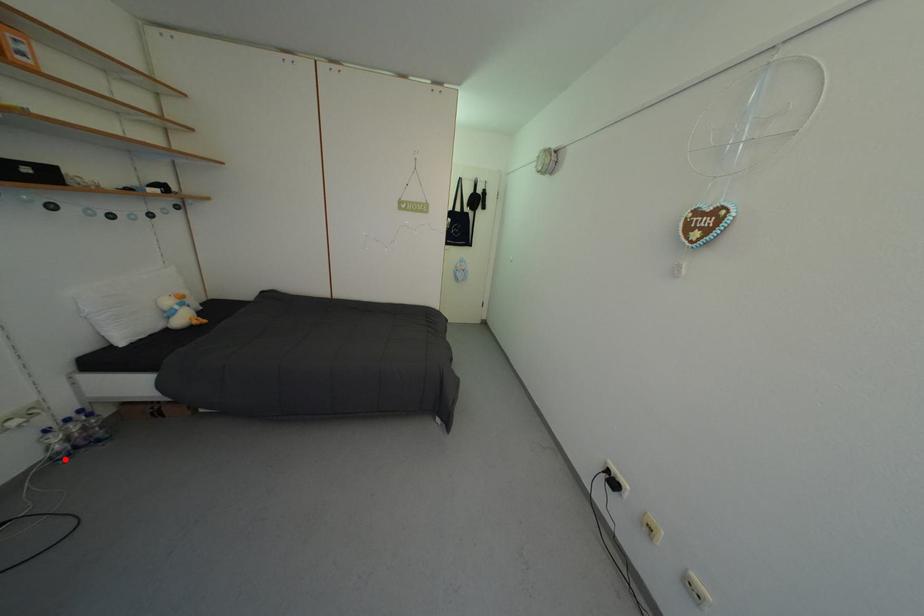
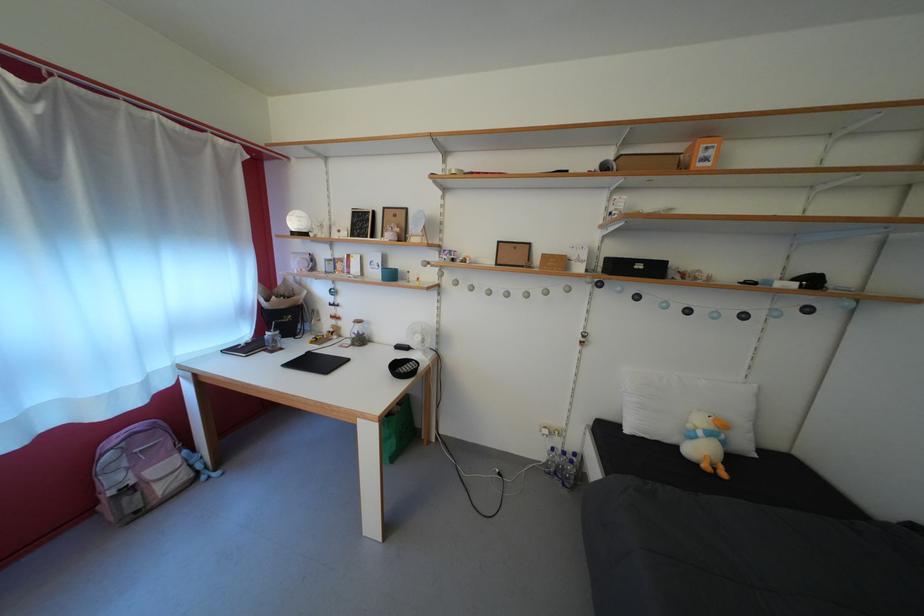
Where in the second image is the point corresponding to the highlighted location from the first image?

(554, 472)